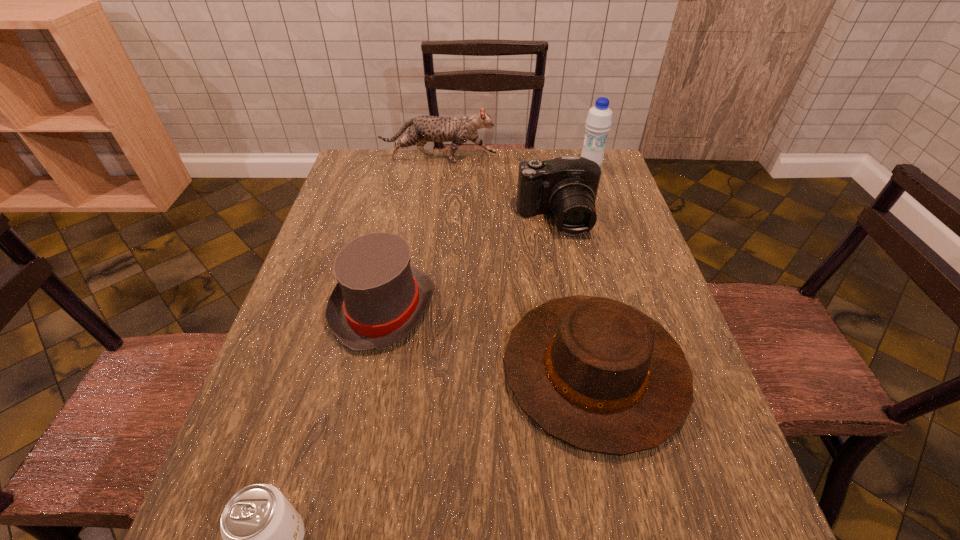
You are a GUI agent. You are given a task and a screenshot of the screen. Output one action in this format:
    pyautogui.click(x=<x>, y=<y>)
    Task: Click on the water bottle present at the far edge
    The height and width of the screenshot is (540, 960).
    Given the screenshot: What is the action you would take?
    pyautogui.click(x=599, y=119)

Image resolution: width=960 pixels, height=540 pixels. In order to click on cat that is at the far edge in this screenshot , I will do `click(422, 129)`.

Locate an element on the screen. cat at the left edge is located at coordinates (422, 129).

Find the location of a particular element. dress hat present at the left edge is located at coordinates (379, 298).

Find the location of a particular element. water bottle that is positioned at the right edge is located at coordinates (599, 119).

Find the location of a particular element. This screenshot has height=540, width=960. camera present at the right edge is located at coordinates (567, 186).

You are a GUI agent. You are given a task and a screenshot of the screen. Output one action in this format:
    pyautogui.click(x=<x>, y=<y>)
    Task: Click on the cowboy hat present at the right edge
    The image size is (960, 540).
    Given the screenshot: What is the action you would take?
    pyautogui.click(x=597, y=374)

This screenshot has width=960, height=540. Find the location of `object that is at the far left corner`. object that is at the far left corner is located at coordinates (422, 129).

At what (x,y) coordinates should I click in order to perform the action: click on object positioned at the far right corner. Please return your answer as a coordinate pair (x, y). This screenshot has height=540, width=960. Looking at the image, I should click on (599, 119).

Where is `vacant space at the far edge of the desktop`? vacant space at the far edge of the desktop is located at coordinates (513, 180).